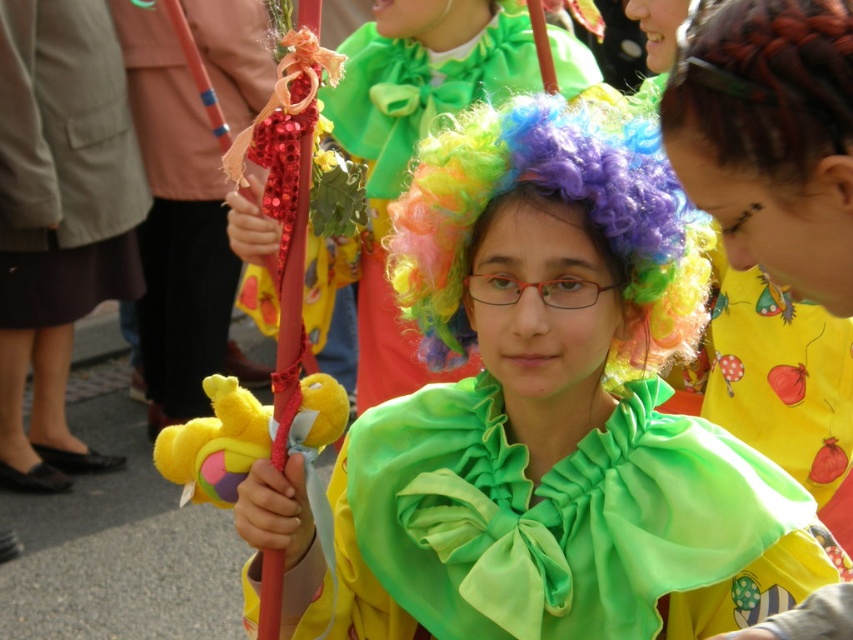
Who is positioned more to the right, shiny green cape at center or multicolored curly wig at center?

shiny green cape at center

Is point (369, 483) less distant than point (439, 289)?

No, (369, 483) is behind (439, 289).

Image resolution: width=853 pixels, height=640 pixels. Identify the location of shiny green cape at center. (552, 403).

Between green satin cape at center and multicolored curly wig at center, which one has more height?

Standing taller between the two is multicolored curly wig at center.

Can you confirm if green satin cape at center is positioned below multicolored curly wig at center?

Correct, green satin cape at center is located below multicolored curly wig at center.

Which is in front, point (444, 593) or point (415, 259)?

Positioned in front is point (415, 259).

Where is `green satin cape at center`? Image resolution: width=853 pixels, height=640 pixels. green satin cape at center is located at coordinates (563, 525).

Who is positioned more to the right, shiny green fabric at center or soft plush toy at center?

Positioned to the right is shiny green fabric at center.

Between point (434, 42) and point (189, 470), which one is positioned in front?

Positioned in front is point (189, 470).

Does point (440, 376) come behind point (231, 406)?

Yes.

This screenshot has width=853, height=640. I want to click on shiny green fabric at center, so click(415, 144).